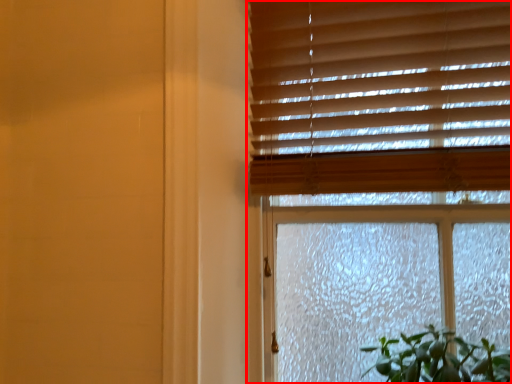
Question: Where is window (annotated by the red box) located in relation to blind in the image?

Choices:
 (A) left
 (B) right

Answer: (A)